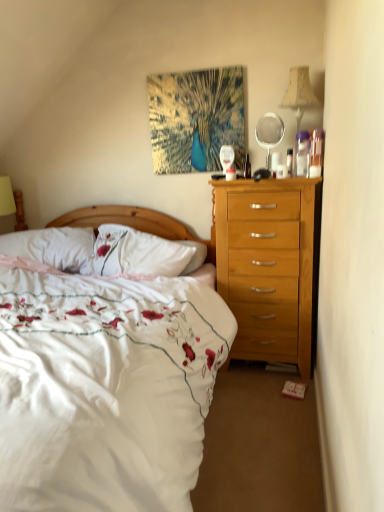
Question: Can you confirm if white soft pillow at left is taller than clear plastic mirror at upper right?

Choices:
 (A) no
 (B) yes

Answer: (A)

Question: Is white soft pillow at left outside clear plastic mirror at upper right?

Choices:
 (A) no
 (B) yes

Answer: (B)

Question: Is white soft pillow at left oriented towards clear plastic mirror at upper right?

Choices:
 (A) no
 (B) yes

Answer: (A)

Question: Can you confirm if white soft pillow at left is wider than clear plastic mirror at upper right?

Choices:
 (A) no
 (B) yes

Answer: (B)

Question: Can you confirm if white soft pillow at left is shorter than clear plastic mirror at upper right?

Choices:
 (A) yes
 (B) no

Answer: (A)

Question: Is the position of white soft pillow at left less distant than that of clear plastic mirror at upper right?

Choices:
 (A) yes
 (B) no

Answer: (B)

Question: Is white soft pillow at left not near beige fabric lampshade at upper right?

Choices:
 (A) yes
 (B) no

Answer: (A)

Question: From the image's perspective, is white soft pillow at left located beneath beige fabric lampshade at upper right?

Choices:
 (A) yes
 (B) no

Answer: (A)

Question: From a real-world perspective, is white soft pillow at left over beige fabric lampshade at upper right?

Choices:
 (A) no
 (B) yes

Answer: (A)

Question: Can you confirm if white soft pillow at left is wider than beige fabric lampshade at upper right?

Choices:
 (A) yes
 (B) no

Answer: (A)

Question: Is white soft pillow at left bigger than beige fabric lampshade at upper right?

Choices:
 (A) yes
 (B) no

Answer: (A)

Question: Is white soft pillow at left closer to the viewer compared to beige fabric lampshade at upper right?

Choices:
 (A) yes
 (B) no

Answer: (B)

Question: Could you tell me if clear plastic mirror at upper right is turned towards white soft pillow at left?

Choices:
 (A) yes
 (B) no

Answer: (B)